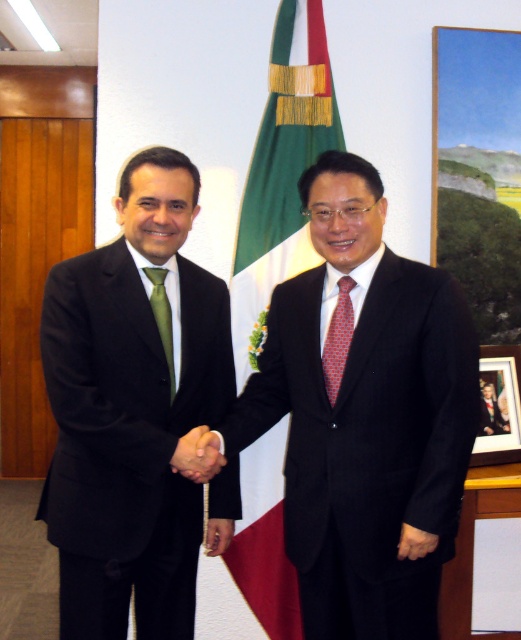
Can you confirm if green fabric flag at center is positioned above green silk tie at center?

Indeed, green fabric flag at center is positioned over green silk tie at center.

Does point (253, 544) lie behind point (173, 396)?

Yes.

This screenshot has width=521, height=640. Identify the location of green fabric flag at center. (281, 173).

Is dark suit at center thinner than green fabric flag at center?

No, dark suit at center is not thinner than green fabric flag at center.

Can you confirm if dark suit at center is wider than green fabric flag at center?

Yes, dark suit at center is wider than green fabric flag at center.

What do you see at coordinates (365, 417) in the screenshot? Image resolution: width=521 pixels, height=640 pixels. I see `dark suit at center` at bounding box center [365, 417].

Locate an element on the screen. dark suit at center is located at coordinates (365, 417).

Can you confirm if green fabric flag at center is taller than wooden picture frame at right?

Correct, green fabric flag at center is much taller as wooden picture frame at right.

Does point (262, 244) come behind point (494, 369)?

No, (262, 244) is closer to viewer.

Is point (254, 502) farther from camera compared to point (518, 362)?

No, (254, 502) is closer to viewer.

Where is `green fabric flag at center`? Image resolution: width=521 pixels, height=640 pixels. green fabric flag at center is located at coordinates (x=281, y=173).